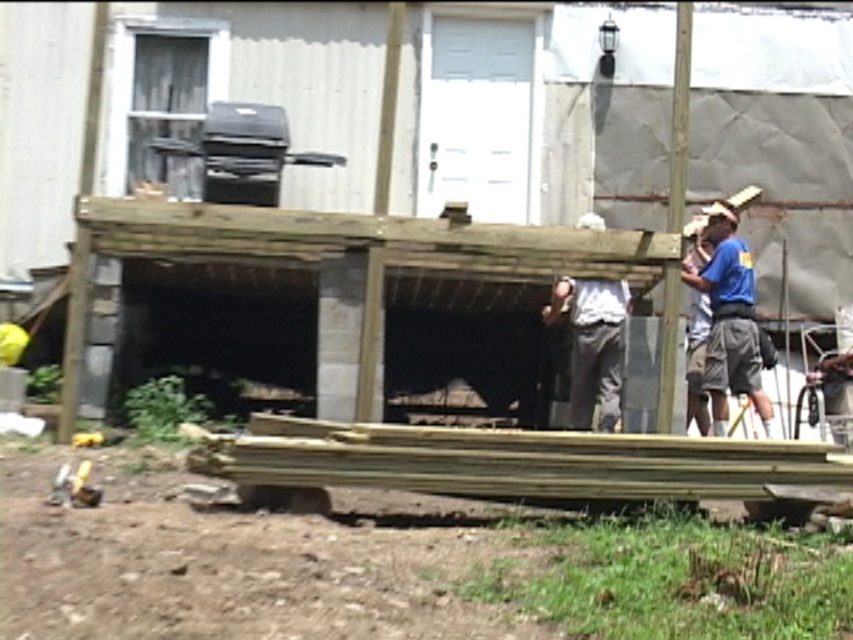
You are a construction worker standing in front of the building with corrugated metal exterior. You see a blue fabric shirt at right and a white cotton shirt at center. Which shirt is closer to you?

The blue fabric shirt at right is closer to you because it is further to the viewer than the white cotton shirt at center.

You are a construction worker who needs to choose a shirt that is taller between the blue fabric shirt at right and the white cotton shirt at center. Which one should you pick?

The blue fabric shirt at right has a greater height compared to the white cotton shirt at center, so you should pick the blue fabric shirt at right.

You are standing in the construction area and want to place a new beam between the two points, point (x=718, y=392) and point (x=585, y=330). Which point should the beam start from to ensure it slopes downward towards the other point?

The beam should start from point (x=718, y=392) because it is closer to the camera, so placing the beam there will slope downward toward point (x=585, y=330) which is further away.